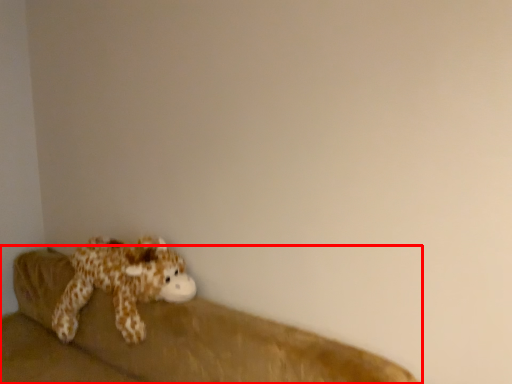
Question: In this image, where is studio couch (annotated by the red box) located relative to toy?

Choices:
 (A) right
 (B) left

Answer: (A)